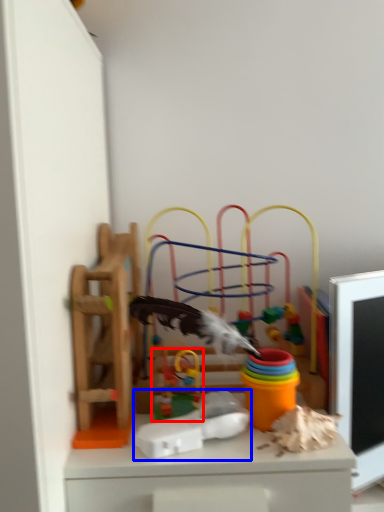
Question: Which object appears farthest to the camera in this image, toy (highlighted by a red box) or toy (highlighted by a blue box)?

Choices:
 (A) toy
 (B) toy

Answer: (A)